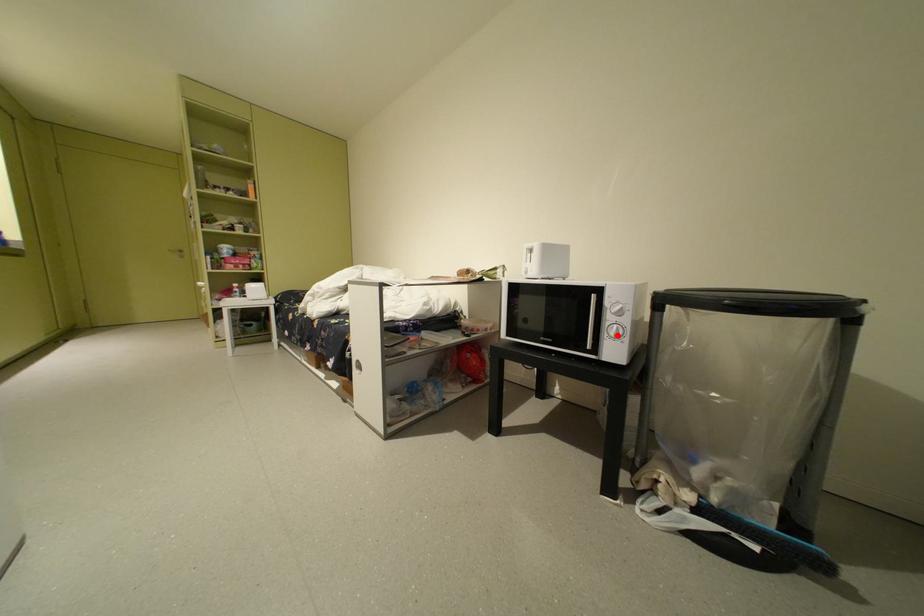
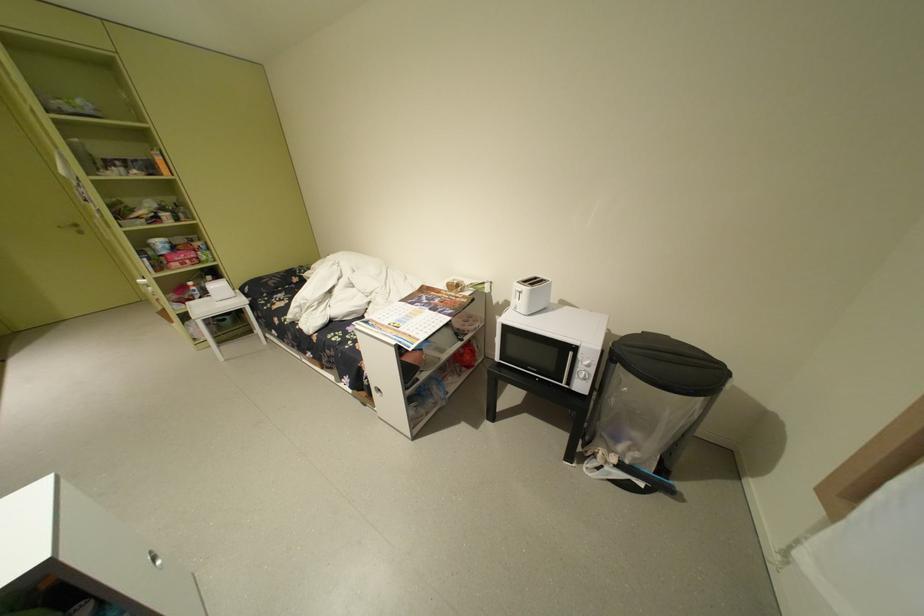
Where in the second image is the point corresponding to the highlighted location from the first image?

(588, 377)